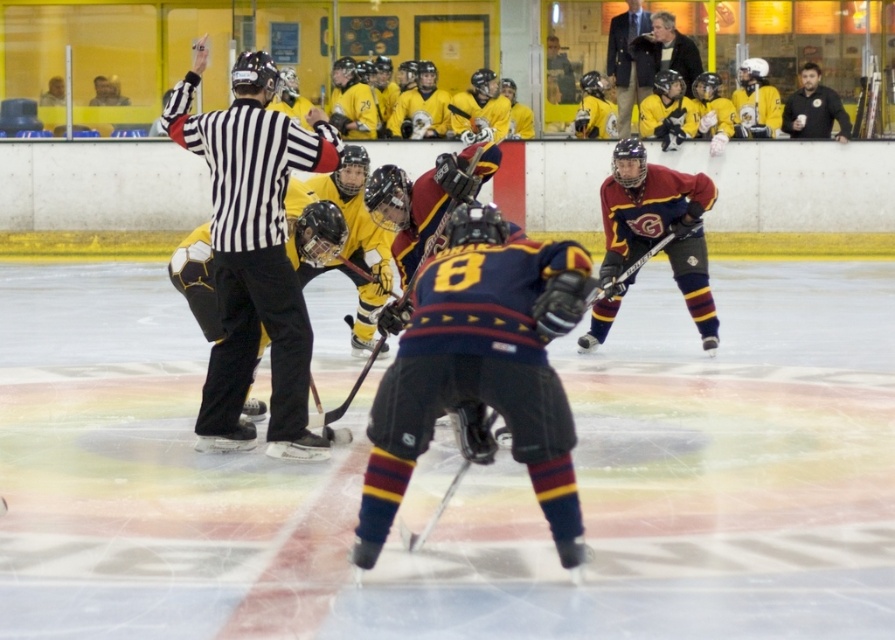
Question: Which of these objects is positioned closest to the dark brown leather jacket at upper right?

Choices:
 (A) dark blue jersey at center
 (B) maroon jersey at center
 (C) black matte hockey stick at center

Answer: (B)

Question: Which is nearer to the dark brown leather jacket at upper right?

Choices:
 (A) dark blue jersey at center
 (B) black matte hockey stick at center
 (C) maroon jersey at center

Answer: (C)

Question: Is black matte hockey stick at center above dark brown leather jacket at upper right?

Choices:
 (A) yes
 (B) no

Answer: (B)

Question: Considering the relative positions of dark blue jersey at center and maroon jersey at center in the image provided, where is dark blue jersey at center located with respect to maroon jersey at center?

Choices:
 (A) right
 (B) left

Answer: (B)

Question: Can you confirm if dark blue jersey at center is bigger than dark brown leather jacket at upper right?

Choices:
 (A) yes
 (B) no

Answer: (B)

Question: Which object is positioned closest to the dark blue jersey at center?

Choices:
 (A) black matte hockey stick at center
 (B) maroon jersey at center
 (C) dark brown leather jacket at upper right

Answer: (A)